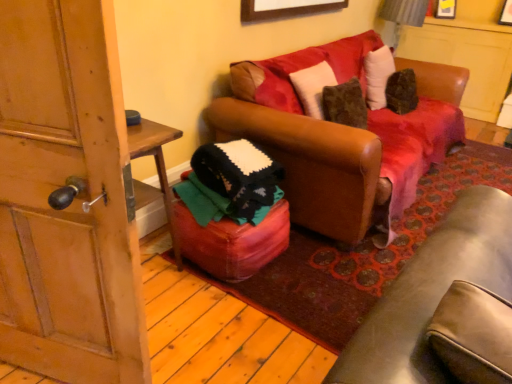
At what (x,y) coordinates should I click in order to perform the action: click on free space between brown leather couch at center and leather ottoman at center. Please return your answer as a coordinate pair (x, y). The height and width of the screenshot is (384, 512). Looking at the image, I should click on (294, 266).